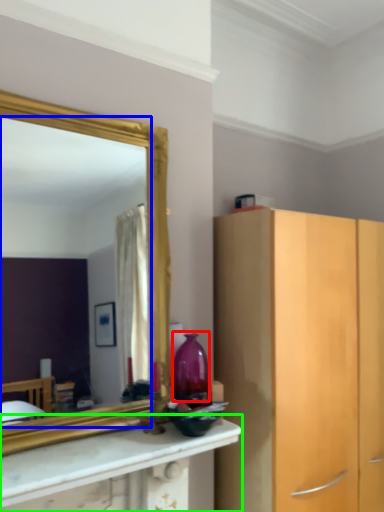
Question: Which object is the farthest from vase (highlighted by a red box)? Choose among these: mirror (highlighted by a blue box) or countertop (highlighted by a green box).

Choices:
 (A) mirror
 (B) countertop

Answer: (A)